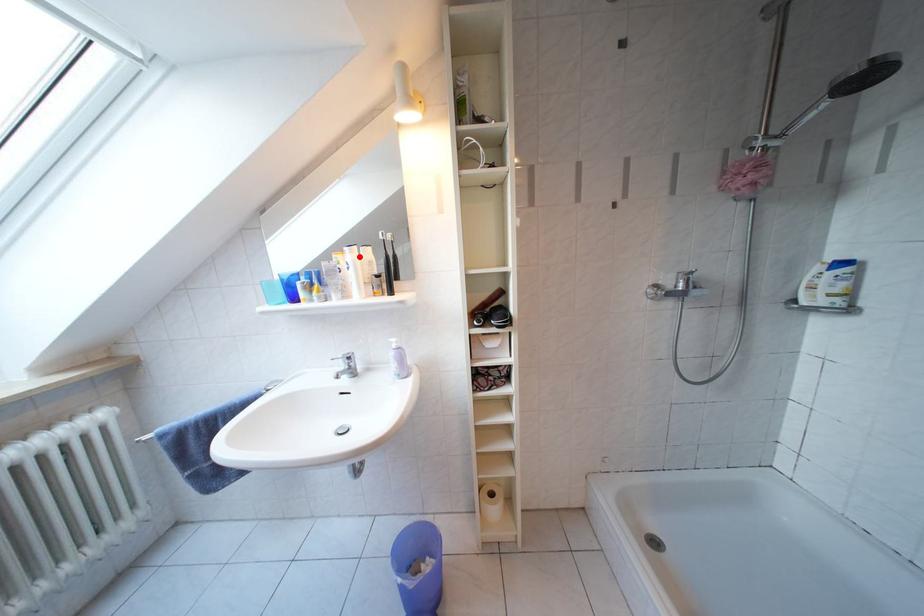
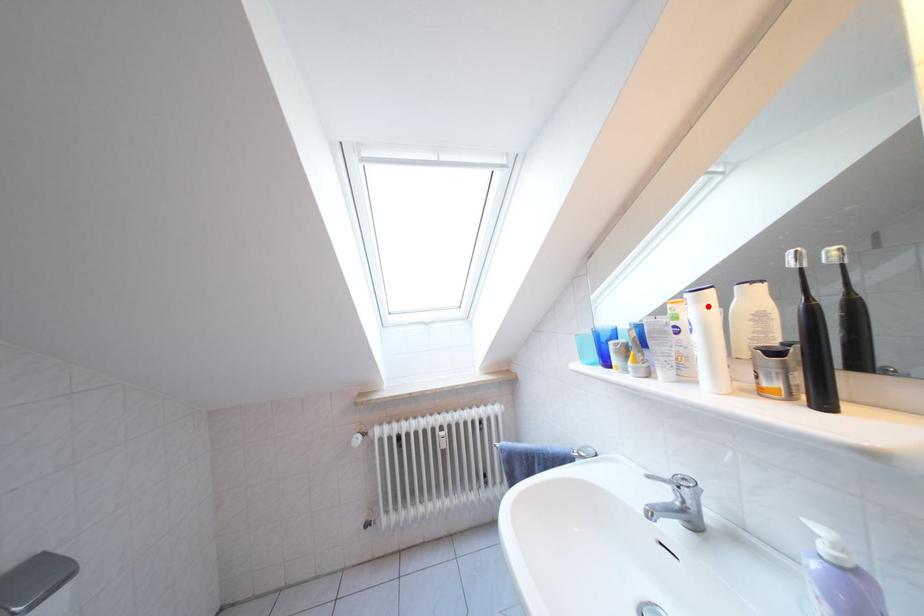
I am providing you with two images of the same scene from different viewpoints. A red point is marked on the first image and another point is marked on the second image. Is the marked point in image1 the same physical position as the marked point in image2?

Yes